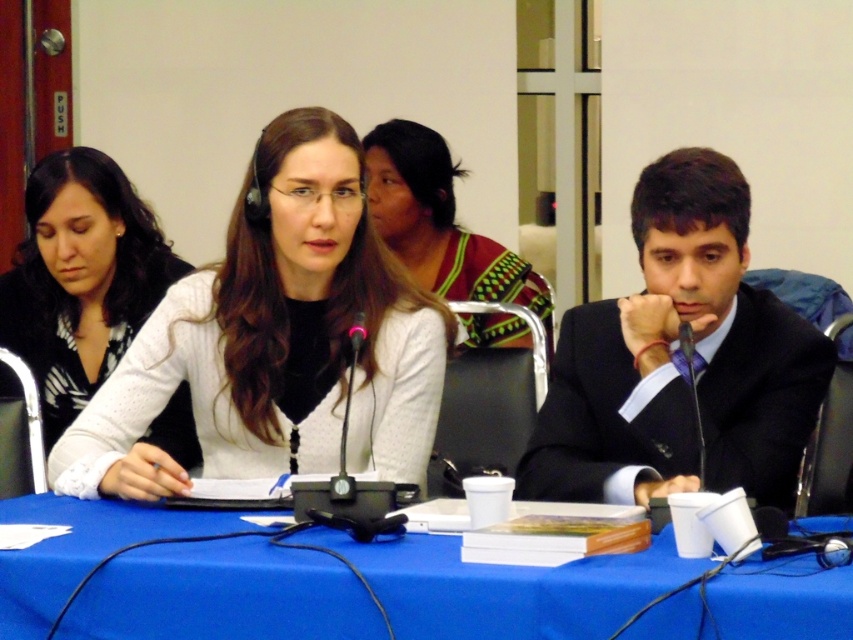
Question: Can you confirm if white matte sweater at center is positioned above black suit at right?

Choices:
 (A) no
 (B) yes

Answer: (A)

Question: Considering the relative positions of black suit at right and white knit sweater at center in the image provided, where is black suit at right located with respect to white knit sweater at center?

Choices:
 (A) left
 (B) right

Answer: (B)

Question: Which of these objects is positioned farthest from the patterned fabric top at center?

Choices:
 (A) white knit sweater at center
 (B) black suit at right

Answer: (B)

Question: Does black suit at right appear over white knit sweater at center?

Choices:
 (A) yes
 (B) no

Answer: (B)

Question: Estimate the real-world distances between objects in this image. Which object is closer to the patterned fabric top at center?

Choices:
 (A) blue fabric table at center
 (B) white knit sweater at center

Answer: (B)

Question: Which point is farther from the camera taking this photo?

Choices:
 (A) (277, 120)
 (B) (109, 627)

Answer: (A)